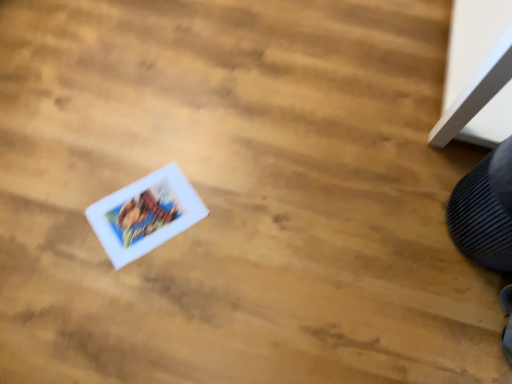
The width and height of the screenshot is (512, 384). I want to click on free space in front of black textured shoe at lower right, so click(x=459, y=304).